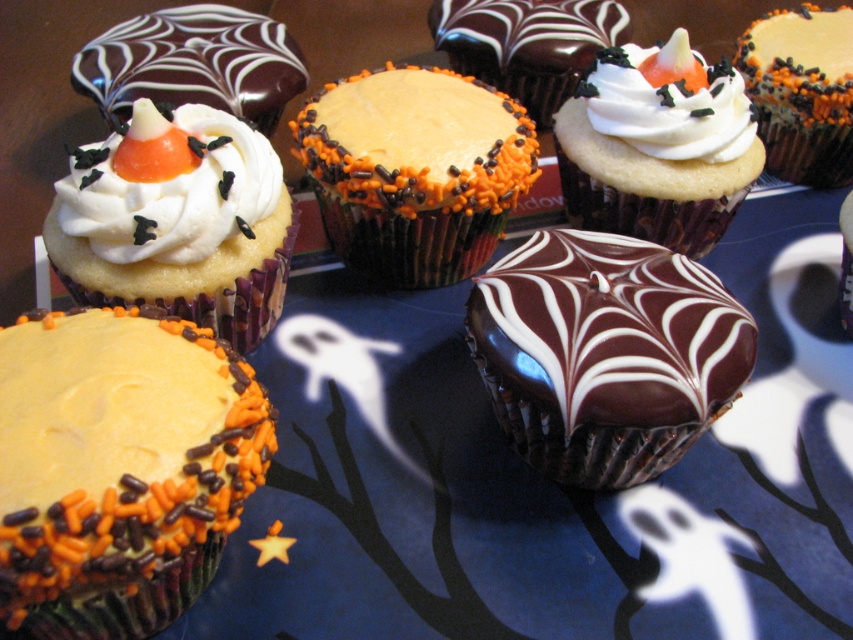
You are a baker who wants to place a small Halloween decoration on the matte white frosting at center and the chocolate glaze spiderweb cupcake at center. Which cupcake should you choose if you want to ensure the decoration fits without overlapping the edges?

The matte white frosting at center is smaller than the chocolate glaze spiderweb cupcake at center, so you should choose the chocolate glaze spiderweb cupcake at center to ensure the decoration fits without overlapping the edges.

You are standing in front of the Halloween cupcake display. There are two points marked on the image at coordinates point (199, 392) and point (772, 120). Which point is closer to you?

Point (199, 392) is closer to you because it is in front of point (772, 120).